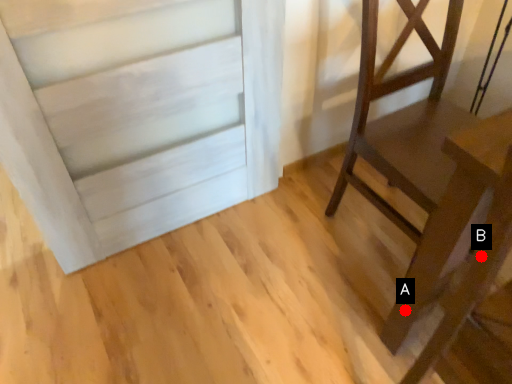
Question: Two points are circled on the image, labeled by A and B beside each circle. Which of the following is the farthest from the observer?

Choices:
 (A) A is further
 (B) B is further

Answer: (A)